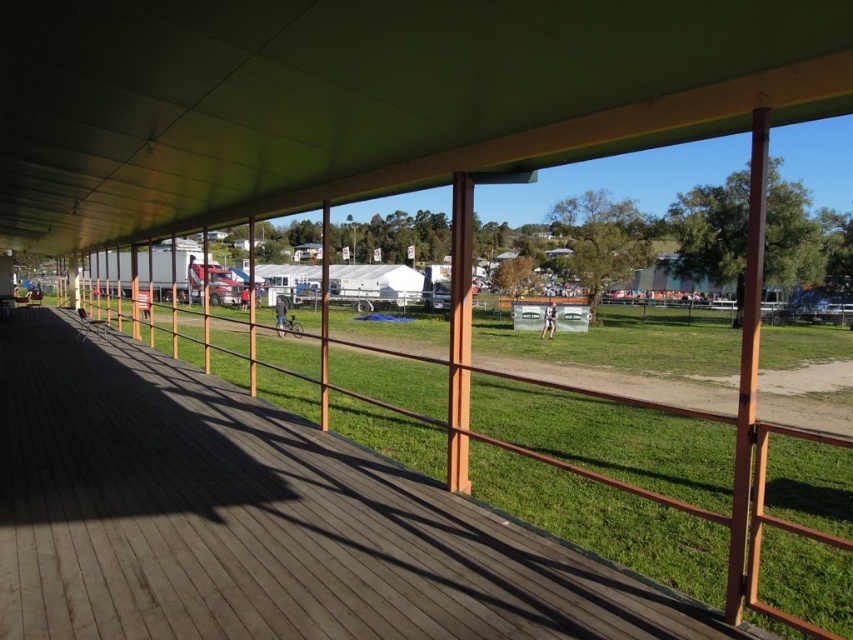
You are standing on the wooden deck and want to take a photo of the outdoor event area. You notice two points marked in the image. Which point, point (161, 196) or point (199, 525), is closer to you when looking through the camera lens?

Point (161, 196) is closer to you because it is further to the viewer than point (199, 525), meaning it appears nearer in the image.

You are standing on the wooden deck and want to locate the green matte canopy at upper center. According to the coordinates provided, what are the exact coordinates where you should look to find it?

The green matte canopy at upper center is located at coordinates point [368,97].

You are planning to host a small gathering and need to know which area can accommodate more guests comfortably. Based on the scene, which object between the green matte canopy at upper center and the brown wooden deck at center would be more suitable for hosting a larger group?

The green matte canopy at upper center has a larger size compared to the brown wooden deck at center, making it more suitable for hosting a larger group comfortably.